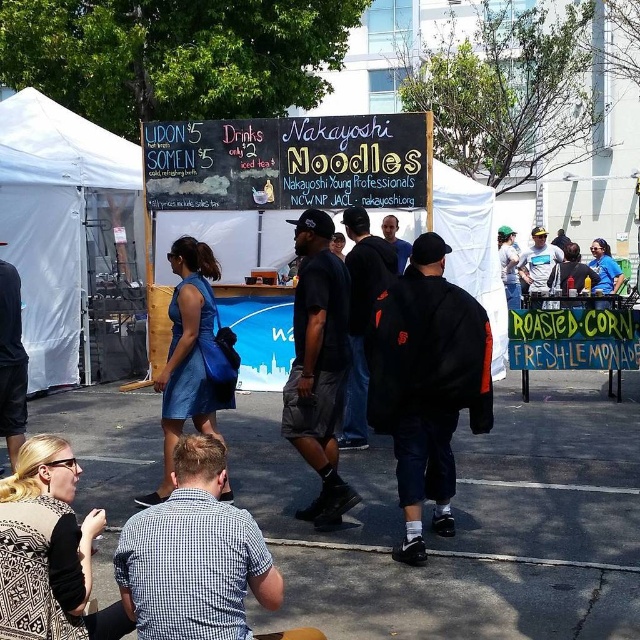
Does black matte jacket at center have a lesser width compared to blue jersey at right?

Yes.

Which is in front, point (394, 296) or point (600, 241)?

Point (394, 296) is in front.

The image size is (640, 640). What do you see at coordinates (426, 384) in the screenshot? I see `black matte jacket at center` at bounding box center [426, 384].

Where is `black matte jacket at center`? black matte jacket at center is located at coordinates (426, 384).

Who is positioned more to the right, black matte shorts at center or blue jersey at right?

Positioned to the right is blue jersey at right.

Is black matte shorts at center closer to the viewer compared to blue jersey at right?

Yes, it is.

Where is `black matte shorts at center`? This screenshot has width=640, height=640. black matte shorts at center is located at coordinates (317, 364).

Which of these two, white fabric tent at left or blue jersey at right, stands taller?

white fabric tent at left

Does white fabric tent at left appear on the right side of blue jersey at right?

No, white fabric tent at left is not to the right of blue jersey at right.

The width and height of the screenshot is (640, 640). Identify the location of white fabric tent at left. (72, 243).